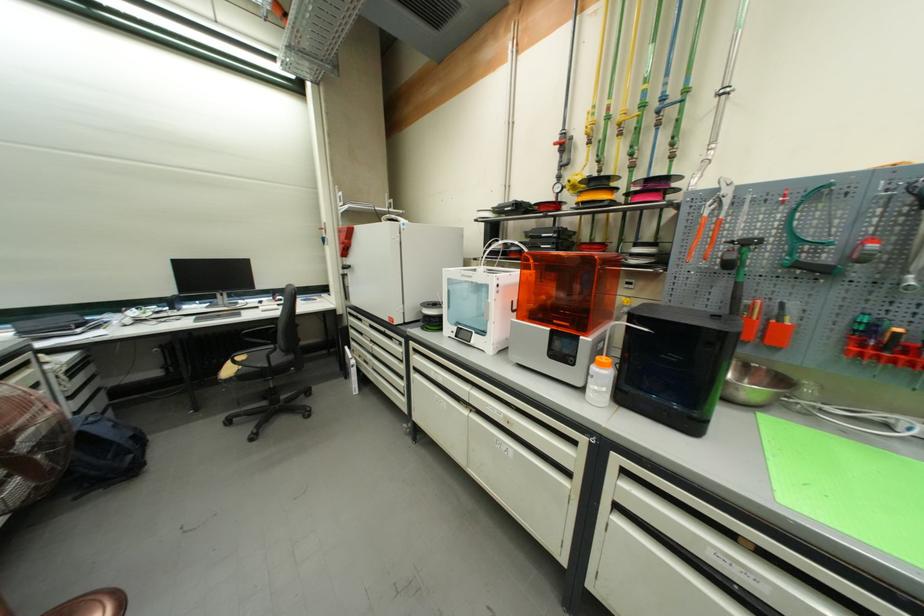
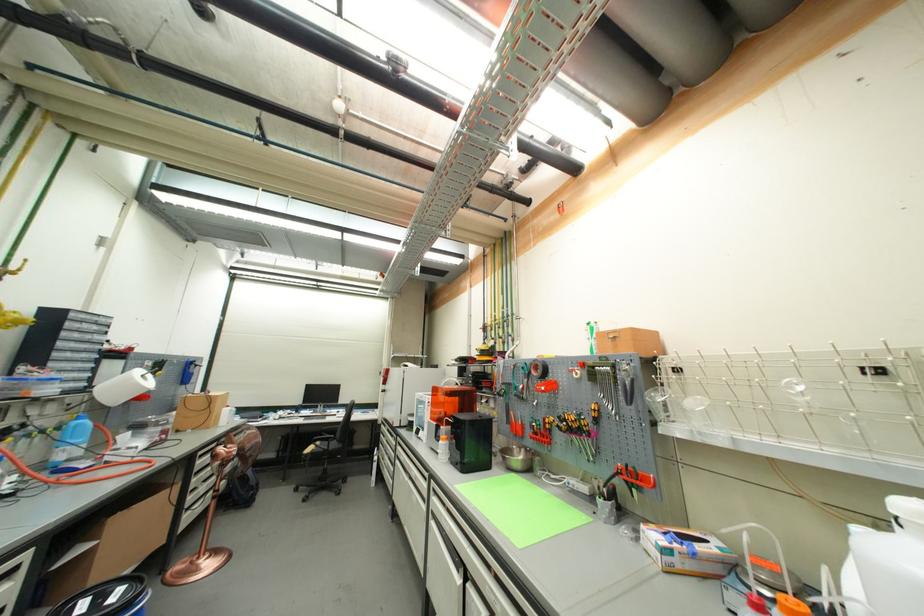
In the second image, find the point that corresponds to pixel 351 350 in the first image.

(382, 450)